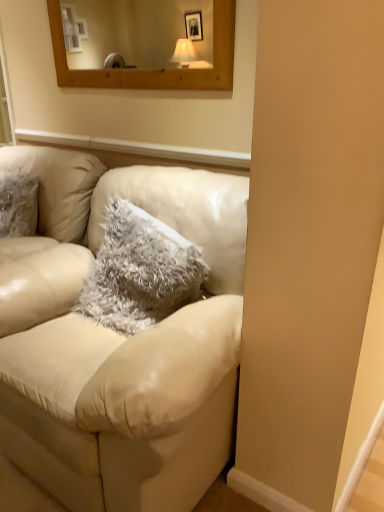
The width and height of the screenshot is (384, 512). What do you see at coordinates (118, 343) in the screenshot?
I see `matte cream leather couch at center` at bounding box center [118, 343].

Locate an element on the screen. The height and width of the screenshot is (512, 384). matte cream leather couch at center is located at coordinates (118, 343).

Measure the distance between fuzzy gray pillow at center and camera.

A distance of 4.58 feet exists between fuzzy gray pillow at center and camera.

What do you see at coordinates (138, 273) in the screenshot? I see `fuzzy gray pillow at center` at bounding box center [138, 273].

Locate an element on the screen. The height and width of the screenshot is (512, 384). fuzzy gray pillow at center is located at coordinates (138, 273).

The height and width of the screenshot is (512, 384). Identify the location of matte cream leather couch at center. (118, 343).

In the image, is fuzzy gray pillow at center on the left side or the right side of matte cream leather couch at center?

From the image, it's evident that fuzzy gray pillow at center is to the right of matte cream leather couch at center.

Looking at this image, considering the positions of objects fuzzy gray pillow at center and matte cream leather couch at center in the image provided, who is in front, fuzzy gray pillow at center or matte cream leather couch at center?

matte cream leather couch at center is in front.

Is point (204, 273) in front of point (153, 468)?

No, (204, 273) is behind (153, 468).

From the image's perspective, is fuzzy gray pillow at center on top of matte cream leather couch at center?

Correct, fuzzy gray pillow at center appears higher than matte cream leather couch at center in the image.

From a real-world perspective, is fuzzy gray pillow at center located beneath matte cream leather couch at center?

Incorrect, from a real-world perspective, fuzzy gray pillow at center is higher than matte cream leather couch at center.

Which of these two, fuzzy gray pillow at center or matte cream leather couch at center, is wider?

With larger width is matte cream leather couch at center.

Between fuzzy gray pillow at center and matte cream leather couch at center, which one has more height?

matte cream leather couch at center.

Is fuzzy gray pillow at center bigger or smaller than matte cream leather couch at center?

fuzzy gray pillow at center is smaller than matte cream leather couch at center.

Is matte cream leather couch at center a part of fuzzy gray pillow at center?

Definitely not — matte cream leather couch at center is not inside fuzzy gray pillow at center.

Are fuzzy gray pillow at center and matte cream leather couch at center beside each other?

No, fuzzy gray pillow at center is not in contact with matte cream leather couch at center.

Is fuzzy gray pillow at center facing towards matte cream leather couch at center?

Yes, fuzzy gray pillow at center is aimed at matte cream leather couch at center.

How far apart are fuzzy gray pillow at center and matte cream leather couch at center?

23.24 centimeters.

This screenshot has height=512, width=384. Identify the location of pillow located on the right of matte cream leather couch at center. (138, 273).

In the scene shown: Is matte cream leather couch at center at the left side of fuzzy gray pillow at center?

Indeed, matte cream leather couch at center is positioned on the left side of fuzzy gray pillow at center.

Is the position of matte cream leather couch at center more distant than that of fuzzy gray pillow at center?

No.

Is point (80, 490) positioned behind point (117, 298)?

No, it is not.

From the image's perspective, is matte cream leather couch at center under fuzzy gray pillow at center?

Yes, from the image's perspective, matte cream leather couch at center is beneath fuzzy gray pillow at center.

Looking at this image, from a real-world perspective, who is located higher, matte cream leather couch at center or fuzzy gray pillow at center?

Result: From a 3D spatial view, fuzzy gray pillow at center is above.

Is matte cream leather couch at center thinner than fuzzy gray pillow at center?

Answer: In fact, matte cream leather couch at center might be wider than fuzzy gray pillow at center.

Is matte cream leather couch at center taller or shorter than fuzzy gray pillow at center?

In the image, matte cream leather couch at center appears to be taller than fuzzy gray pillow at center.

Looking at the image, does matte cream leather couch at center seem bigger or smaller compared to fuzzy gray pillow at center?

matte cream leather couch at center is bigger than fuzzy gray pillow at center.

Do you think matte cream leather couch at center is within fuzzy gray pillow at center, or outside of it?

matte cream leather couch at center is not enclosed by fuzzy gray pillow at center.

Is matte cream leather couch at center directly adjacent to fuzzy gray pillow at center?

No, matte cream leather couch at center is not in contact with fuzzy gray pillow at center.

Is matte cream leather couch at center aimed at fuzzy gray pillow at center?

Yes, matte cream leather couch at center is oriented towards fuzzy gray pillow at center.

Locate an element on the screen. This screenshot has height=512, width=384. pillow on the right of matte cream leather couch at center is located at coordinates (138, 273).

Identify the location of pillow that is above the matte cream leather couch at center (from a real-world perspective). (138, 273).

Identify the location of studio couch on the left of fuzzy gray pillow at center. (118, 343).